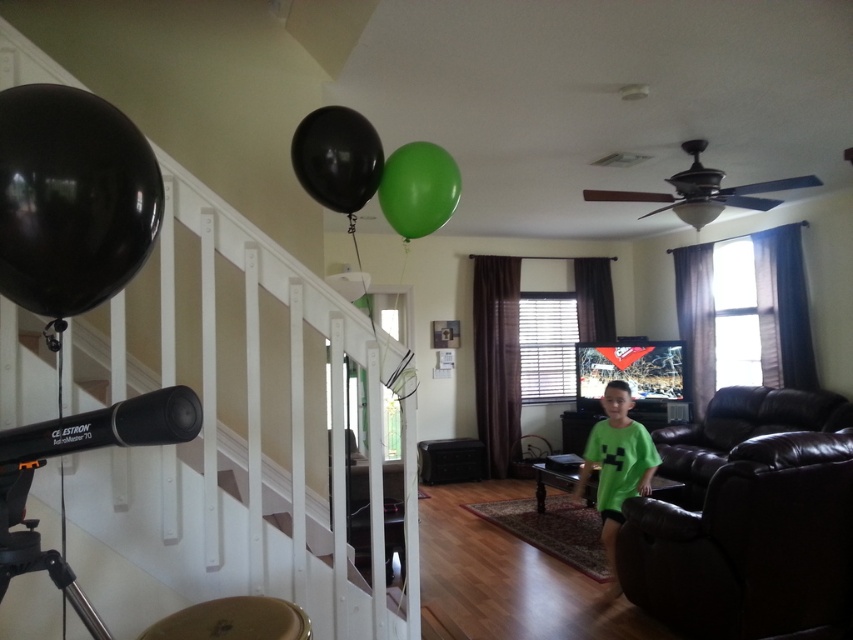
You are a guest at a party in this living room. You notice the black rubber balloon at left and the green matte shirt at lower center. Which object is narrower?

The black rubber balloon at left has a lesser width compared to the green matte shirt at lower center, so the black rubber balloon at left is narrower.

You are standing at the top of the staircase in the living room. You see a black rubber balloon at left and a green matte shirt at lower center. Which object is located to the left of the other?

The black rubber balloon at left is positioned on the left side of green matte shirt at lower center.

You are standing at the top of the staircase in the living room. You see two points marked on the wall. The first point is at coordinates point (97, 259) and the second point is at coordinates point (369, 138). Which point is closer to you?

Point (97, 259) is closer to the camera than point (369, 138), so the first point is closer to you.